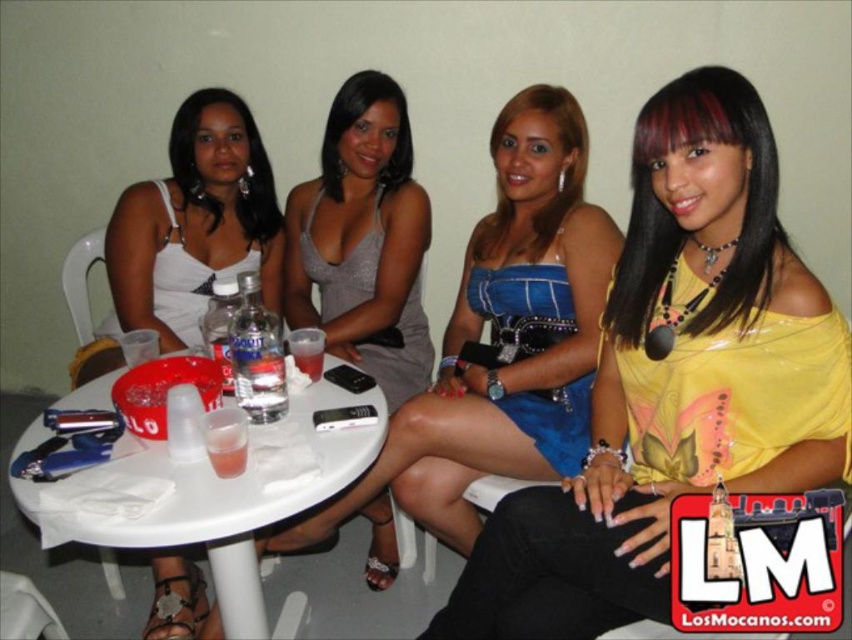
How much distance is there between satin silver dress at center and clear glass bottle at table center?

The distance of satin silver dress at center from clear glass bottle at table center is 26.69 inches.

Can you confirm if satin silver dress at center is taller than clear glass bottle at table center?

Correct, satin silver dress at center is much taller as clear glass bottle at table center.

Which is in front, point (406, 112) or point (269, 404)?

Point (269, 404) is in front.

Identify the location of satin silver dress at center. (363, 241).

Is blue satin dress at center below shiny silver dress at center?

Yes.

Looking at this image, who is more forward, (x=568, y=262) or (x=380, y=177)?

Point (x=568, y=262) is more forward.

Between point (452, 449) and point (366, 104), which one is positioned behind?

Positioned behind is point (366, 104).

The image size is (852, 640). I want to click on blue satin dress at center, so click(x=504, y=337).

Between point (206, 204) and point (256, 369), which one is positioned behind?

The point (206, 204) is behind.

Which of these two, matte black dress at upper left or clear glass bottle at table center, stands taller?

matte black dress at upper left

Between point (200, 173) and point (257, 344), which one is positioned behind?

Point (200, 173)

In order to click on matte black dress at upper left in this screenshot , I will do `click(237, 177)`.